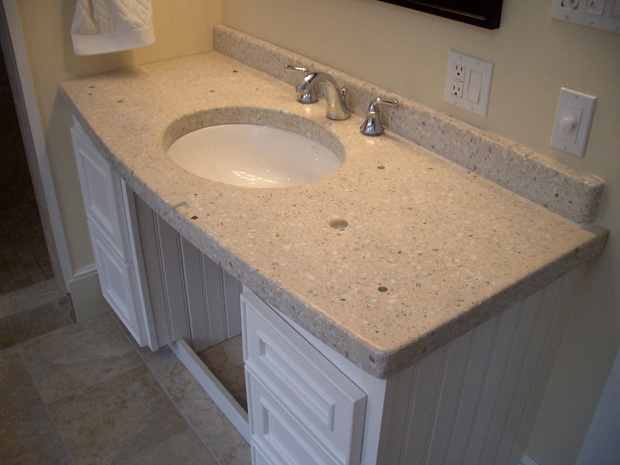
Identify the location of counter iright of sink. This screenshot has width=620, height=465. (403, 263).